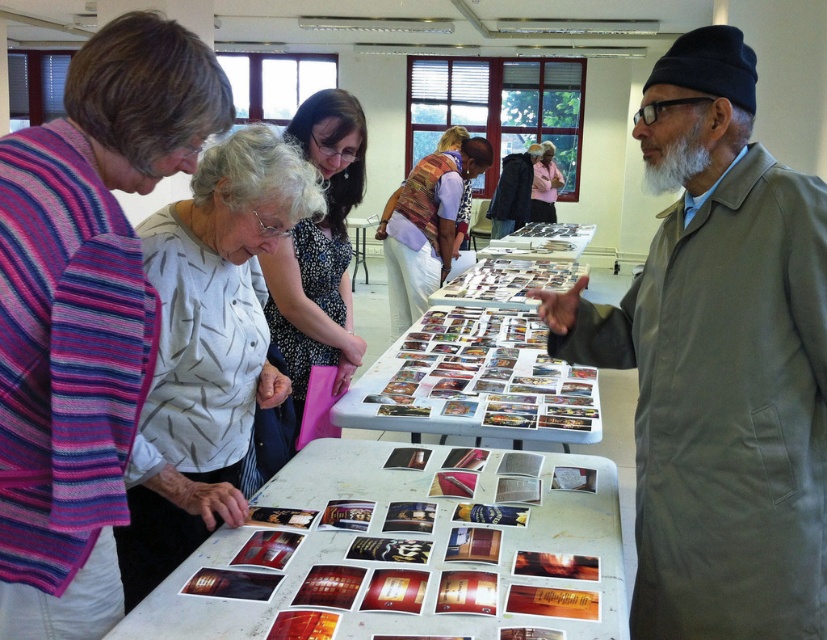
Between point (333, 332) and point (515, 202), which one is positioned in front?

Point (333, 332) is in front.

Between point (349, 154) and point (524, 218), which one is positioned behind?

The point (524, 218) is more distant.

Find the location of a particular element. The height and width of the screenshot is (640, 827). floral dress at center is located at coordinates (319, 252).

Is the position of white paper table at center less distant than that of floral dress at center?

Yes, white paper table at center is in front of floral dress at center.

Does white paper table at center appear on the left side of floral dress at center?

Incorrect, white paper table at center is not on the left side of floral dress at center.

Between point (268, 525) and point (355, 115), which one is positioned in front?

Point (268, 525)

Locate an element on the screen. white paper table at center is located at coordinates (405, 550).

Is floral dress at center to the left of white glossy table at center from the viewer's perspective?

Correct, you'll find floral dress at center to the left of white glossy table at center.

Does point (304, 353) come behind point (574, 252)?

No, (304, 353) is closer to viewer.

Image resolution: width=827 pixels, height=640 pixels. Find the location of `floral dress at center`. floral dress at center is located at coordinates (319, 252).